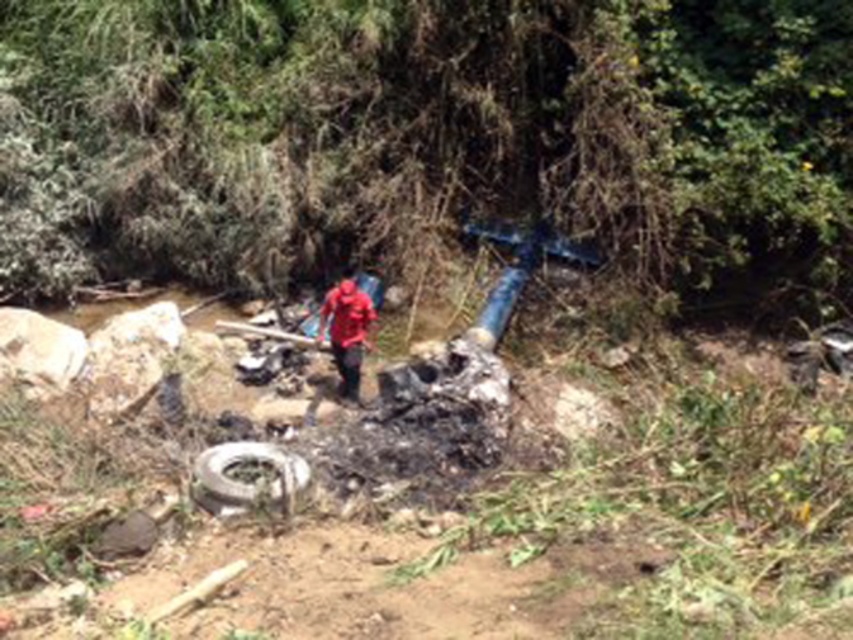
Can you confirm if white rubber tire at lower center is thinner than red matte jacket at center?

No, white rubber tire at lower center is not thinner than red matte jacket at center.

Is white rubber tire at lower center positioned before red matte jacket at center?

Yes.

Find the location of a particular element. The height and width of the screenshot is (640, 853). white rubber tire at lower center is located at coordinates (244, 481).

Find the location of a particular element. Image resolution: width=853 pixels, height=640 pixels. white rubber tire at lower center is located at coordinates (244, 481).